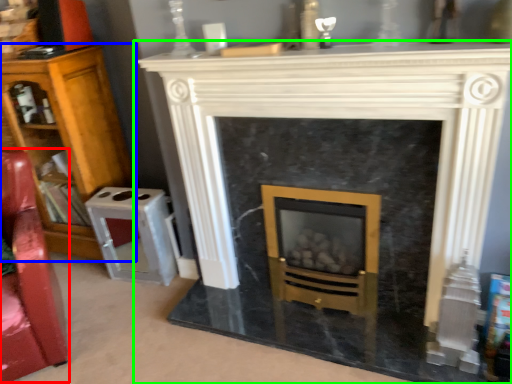
Question: Which is farther away from swivel chair (highlighted by a red box)? bookcase (highlighted by a blue box) or fireplace (highlighted by a green box)?

Choices:
 (A) bookcase
 (B) fireplace

Answer: (B)